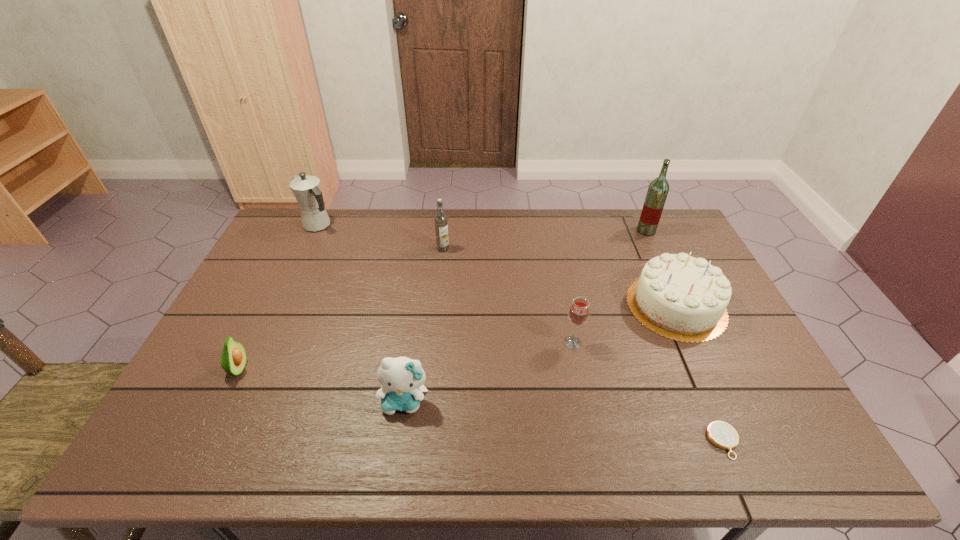
Locate an element on the screen. This screenshot has height=540, width=960. free space at the far edge of the desktop is located at coordinates (346, 244).

Where is `free space at the near edge of the desktop`? Image resolution: width=960 pixels, height=540 pixels. free space at the near edge of the desktop is located at coordinates (319, 437).

At what (x,y) coordinates should I click in order to perform the action: click on free space at the right edge of the desktop. Please return your answer as a coordinate pair (x, y). The width and height of the screenshot is (960, 540). Looking at the image, I should click on (736, 319).

Image resolution: width=960 pixels, height=540 pixels. Identify the location of free spot between the vodka and the wineglass. (508, 295).

Locate an element on the screen. vacant region between the coffeepot and the birthday cake is located at coordinates (497, 266).

Locate an element on the screen. The height and width of the screenshot is (540, 960). vacant area that lies between the coffeepot and the vodka is located at coordinates (381, 238).

Where is `empty space between the avocado and the coffeepot`? This screenshot has height=540, width=960. empty space between the avocado and the coffeepot is located at coordinates pos(278,298).

Where is `unoccupied area between the birthday cake and the wineglass`? The height and width of the screenshot is (540, 960). unoccupied area between the birthday cake and the wineglass is located at coordinates (624, 324).

Where is `free spot between the coffeepot and the seventh farthest object`? The height and width of the screenshot is (540, 960). free spot between the coffeepot and the seventh farthest object is located at coordinates (362, 314).

The width and height of the screenshot is (960, 540). In order to click on free space between the birthday cake and the coffeepot in this screenshot , I will do 497,266.